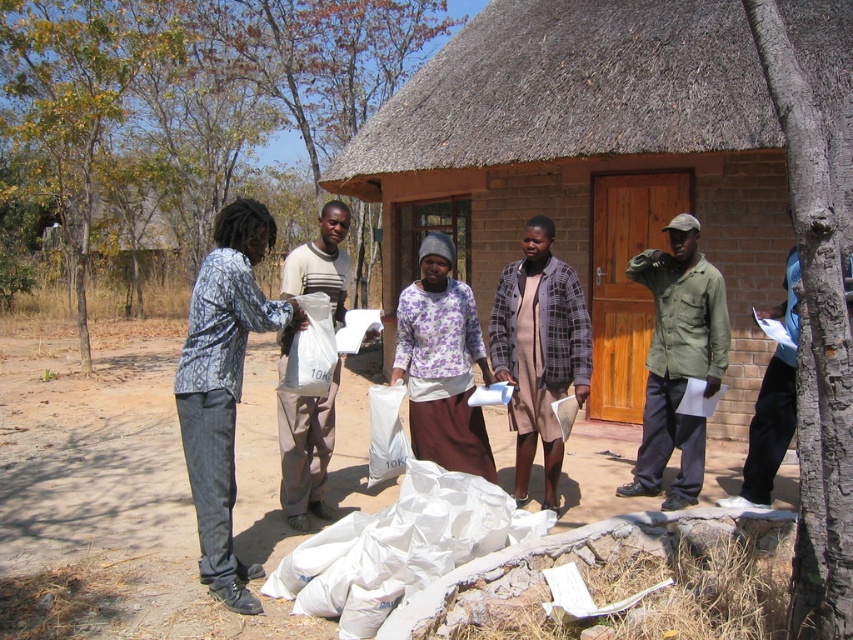
You are a fashion designer observing the scene. You notice two people wearing the patterned fabric shirt at center and the plaid fabric dress at center. Which clothing item takes up more visual space in the image?

The plaid fabric dress at center takes up more visual space than the patterned fabric shirt at center.

You are a photographer trying to capture a clear photo of the purple floral shirt at center and the white matte bag at center. Since you want both to be visible, which object should you focus on to ensure it doesn t get cropped out?

The purple floral shirt at center is bigger than the white matte bag at center, so you should focus on the purple floral shirt at center to ensure it doesn t get cropped out since it takes up more space in the frame.

You are a photographer standing at the edge of the group. You want to capture a photo that includes both the patterned fabric shirt at center and the plaid fabric dress at center. Given that your camera has a maximum focus range of 1.5 meters, will you be able to get both in focus?

The patterned fabric shirt at center and plaid fabric dress at center are 1.65 meters apart. Since the distance between them exceeds the camera focus range of 1.5 meters, you cannot get both in focus simultaneously.